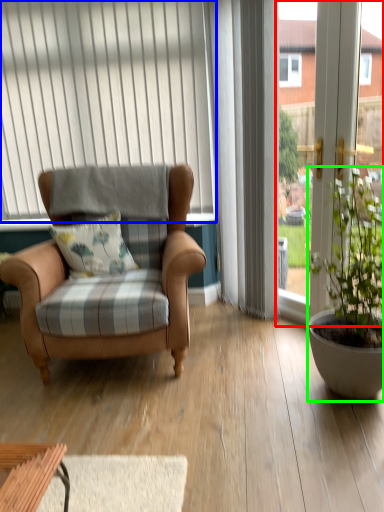
Question: Considering the real-world distances, which object is farthest from window frame (highlighted by a red box)? curtain (highlighted by a blue box) or houseplant (highlighted by a green box)?

Choices:
 (A) curtain
 (B) houseplant

Answer: (A)